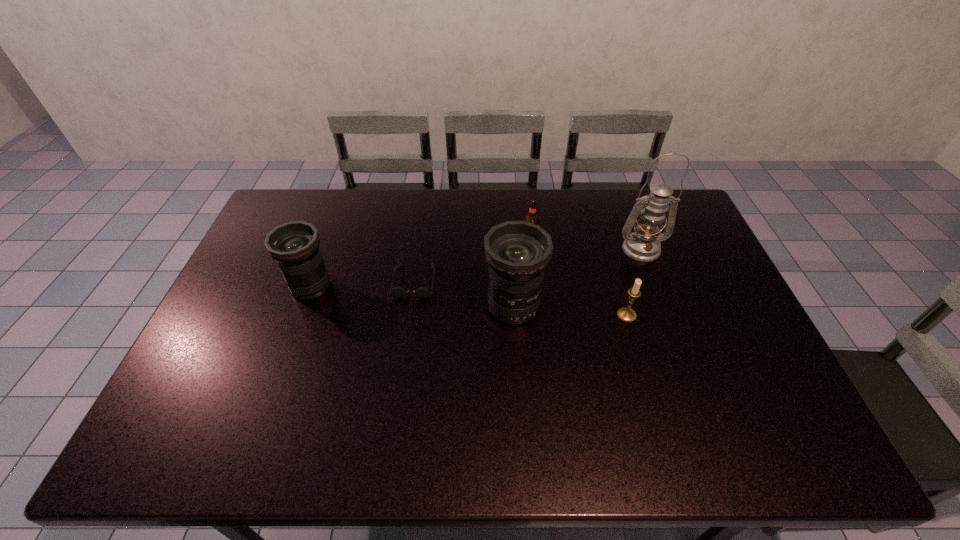
Identify the location of vacant space situated on the front of the shorter telephoto lens. (277, 378).

Where is `vacant point located 0.230m on the back of the taller telephoto lens`? Image resolution: width=960 pixels, height=540 pixels. vacant point located 0.230m on the back of the taller telephoto lens is located at coordinates (509, 235).

At what (x,y) coordinates should I click in order to perform the action: click on blank space located on the front of the rightmost object. Please return your answer as a coordinate pair (x, y). The image size is (960, 540). Looking at the image, I should click on (682, 356).

Find the location of a particular element. This screenshot has height=540, width=960. vacant point located on the right of the second object from right to left is located at coordinates (698, 315).

What are the coordinates of `vacant space situated on the front-facing side of the shortest object` in the screenshot? It's located at (396, 403).

This screenshot has height=540, width=960. I want to click on vacant region located 0.180m on the left of the root beer, so click(470, 238).

The height and width of the screenshot is (540, 960). Identify the location of object present at the right edge. (643, 245).

Where is `free space at the far edge of the desktop`? The width and height of the screenshot is (960, 540). free space at the far edge of the desktop is located at coordinates (417, 227).

Locate an element on the screen. The width and height of the screenshot is (960, 540). free space at the near edge of the desktop is located at coordinates (294, 387).

This screenshot has width=960, height=540. In order to click on vacant space at the left edge of the desktop in this screenshot , I will do `click(269, 270)`.